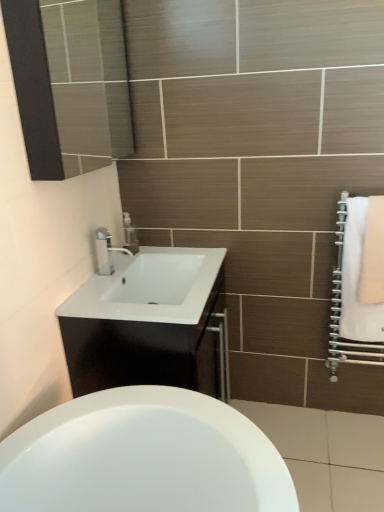
You are a GUI agent. You are given a task and a screenshot of the screen. Output one action in this format:
    pyautogui.click(x=<x>, y=<y>)
    Task: Click on the clear plastic soap dispenser at upper center
    
    Given the screenshot: What is the action you would take?
    pyautogui.click(x=130, y=234)

Image resolution: width=384 pixels, height=512 pixels. What do you see at coordinates (373, 255) in the screenshot?
I see `white soft towel at right, which appears as the 1th bath towel when viewed from the right` at bounding box center [373, 255].

Measure the distance between white glossy cabinet at center and camera.

The depth of white glossy cabinet at center is 4.24 feet.

How much space does white soft towel at right, arranged as the second bath towel when viewed from the right, occupy vertically?

white soft towel at right, arranged as the second bath towel when viewed from the right, is 58.49 centimeters in height.

Describe the element at coordinates (105, 251) in the screenshot. I see `satin nickel faucet at center` at that location.

Locate an element on the screen. This screenshot has width=384, height=512. clear plastic soap dispenser at upper center is located at coordinates (130, 234).

In the image, is clear plastic soap dispenser at upper center positioned in front of or behind black glass mirror at upper left?

clear plastic soap dispenser at upper center is behind black glass mirror at upper left.

Which is behind, point (124, 217) or point (76, 20)?

The point (124, 217) is farther from the camera.

From the image's perspective, relative to black glass mirror at upper left, is clear plastic soap dispenser at upper center above or below?

clear plastic soap dispenser at upper center is below black glass mirror at upper left.

Is clear plastic soap dispenser at upper center not near black glass mirror at upper left?

clear plastic soap dispenser at upper center is near black glass mirror at upper left, not far away.

Is white soft towel at right, which appears as the 1th bath towel when viewed from the right, facing towards white soft towel at right, arranged as the second bath towel when viewed from the right?

Yes, white soft towel at right, which appears as the 1th bath towel when viewed from the right, is oriented towards white soft towel at right, arranged as the second bath towel when viewed from the right.

Does white soft towel at right, which appears as the 1th bath towel when viewed from the right, have a greater height compared to white soft towel at right, arranged as the first bath towel when viewed from the left?

No, white soft towel at right, which appears as the 1th bath towel when viewed from the right, is not taller than white soft towel at right, arranged as the first bath towel when viewed from the left.

Between white soft towel at right, the second bath towel viewed from the left, and white soft towel at right, arranged as the first bath towel when viewed from the left, which one is positioned in front?

white soft towel at right, the second bath towel viewed from the left.

From the image's perspective, is white soft towel at right, the second bath towel viewed from the left, above or below white soft towel at right, arranged as the first bath towel when viewed from the left?

From the image's perspective, white soft towel at right, the second bath towel viewed from the left, appears above white soft towel at right, arranged as the first bath towel when viewed from the left.

Who is taller, black glass mirror at upper left or white soft towel at right, arranged as the second bath towel when viewed from the right?

white soft towel at right, arranged as the second bath towel when viewed from the right, is taller.

How different are the orientations of black glass mirror at upper left and white soft towel at right, arranged as the second bath towel when viewed from the right, in degrees?

They differ by 90 degrees in their facing directions.

This screenshot has width=384, height=512. I want to click on mirror located in front of the white soft towel at right, arranged as the first bath towel when viewed from the left, so click(x=70, y=83).

Between black glass mirror at upper left and white soft towel at right, arranged as the first bath towel when viewed from the left, which one has smaller width?

white soft towel at right, arranged as the first bath towel when viewed from the left.

Can you confirm if satin nickel faucet at center is positioned to the left of white soft towel at right, arranged as the second bath towel when viewed from the right?

Yes.

Is satin nickel faucet at center further to the viewer compared to white soft towel at right, arranged as the first bath towel when viewed from the left?

Yes.

Who is shorter, satin nickel faucet at center or white soft towel at right, arranged as the first bath towel when viewed from the left?

satin nickel faucet at center is shorter.

Are satin nickel faucet at center and white soft towel at right, arranged as the first bath towel when viewed from the left, making contact?

No, satin nickel faucet at center is not with white soft towel at right, arranged as the first bath towel when viewed from the left.

From the image's perspective, which object appears higher, clear plastic soap dispenser at upper center or white soft towel at right, the second bath towel viewed from the left?

clear plastic soap dispenser at upper center, from the image's perspective.

Is clear plastic soap dispenser at upper center wider or thinner than white soft towel at right, which appears as the 1th bath towel when viewed from the right?

clear plastic soap dispenser at upper center is thinner than white soft towel at right, which appears as the 1th bath towel when viewed from the right.

Looking at this image, is clear plastic soap dispenser at upper center looking in the opposite direction of white soft towel at right, the second bath towel viewed from the left?

No, clear plastic soap dispenser at upper center is not facing the opposite direction of white soft towel at right, the second bath towel viewed from the left.

Is clear plastic soap dispenser at upper center taller or shorter than white soft towel at right, which appears as the 1th bath towel when viewed from the right?

clear plastic soap dispenser at upper center is shorter than white soft towel at right, which appears as the 1th bath towel when viewed from the right.

From a real-world perspective, is satin nickel faucet at center physically located above or below clear plastic soap dispenser at upper center?

Clearly, from a real-world perspective, satin nickel faucet at center is above clear plastic soap dispenser at upper center.

Between point (113, 251) and point (129, 221), which one is positioned in front?

Positioned in front is point (113, 251).

Does satin nickel faucet at center appear on the right side of clear plastic soap dispenser at upper center?

In fact, satin nickel faucet at center is to the left of clear plastic soap dispenser at upper center.

From the picture: Is clear plastic soap dispenser at upper center a part of satin nickel faucet at center?

No, clear plastic soap dispenser at upper center is located outside of satin nickel faucet at center.

This screenshot has height=512, width=384. What are the coordinates of `bath towel that is the 2nd object directly below the satin nickel faucet at center (from a real-world perspective)` in the screenshot? It's located at (357, 280).

Would you consider white soft towel at right, arranged as the first bath towel when viewed from the left, to be distant from satin nickel faucet at center?

No, white soft towel at right, arranged as the first bath towel when viewed from the left, is not far from satin nickel faucet at center.

Which object is wider, white soft towel at right, arranged as the second bath towel when viewed from the right, or satin nickel faucet at center?

satin nickel faucet at center is wider.

Identify the location of mirror on the left of clear plastic soap dispenser at upper center. The height and width of the screenshot is (512, 384). (70, 83).

Where is `bath towel on the right of white soft towel at right, arranged as the second bath towel when viewed from the right`? bath towel on the right of white soft towel at right, arranged as the second bath towel when viewed from the right is located at coordinates (373, 255).

From the image, which object appears to be nearer to clear plastic soap dispenser at upper center, white glossy cabinet at center or satin nickel faucet at center?

satin nickel faucet at center.

Looking at the image, which one is located closer to satin nickel faucet at center, white soft towel at right, the second bath towel viewed from the left, or white soft towel at right, arranged as the second bath towel when viewed from the right?

Based on the image, white soft towel at right, arranged as the second bath towel when viewed from the right, appears to be nearer to satin nickel faucet at center.

Estimate the real-world distances between objects in this image. Which object is closer to white glossy cabinet at center, white soft towel at right, the second bath towel viewed from the left, or black glass mirror at upper left?

white soft towel at right, the second bath towel viewed from the left.

From the image, which object appears to be farther from white soft towel at right, arranged as the second bath towel when viewed from the right, clear plastic soap dispenser at upper center or satin nickel faucet at center?

satin nickel faucet at center is further to white soft towel at right, arranged as the second bath towel when viewed from the right.

Estimate the real-world distances between objects in this image. Which object is closer to clear plastic soap dispenser at upper center, white soft towel at right, arranged as the first bath towel when viewed from the left, or white glossy cabinet at center?

Among the two, white glossy cabinet at center is located nearer to clear plastic soap dispenser at upper center.

When comparing their distances from white soft towel at right, arranged as the second bath towel when viewed from the right, does satin nickel faucet at center or white soft towel at right, which appears as the 1th bath towel when viewed from the right, seem further?

Based on the image, satin nickel faucet at center appears to be further to white soft towel at right, arranged as the second bath towel when viewed from the right.

In the scene shown: From the image, which object appears to be farther from white soft towel at right, which appears as the 1th bath towel when viewed from the right, white soft towel at right, arranged as the first bath towel when viewed from the left, or black glass mirror at upper left?

black glass mirror at upper left lies further to white soft towel at right, which appears as the 1th bath towel when viewed from the right, than the other object.

Which object lies further to the anchor point black glass mirror at upper left, white soft towel at right, arranged as the first bath towel when viewed from the left, or white glossy cabinet at center?

The object further to black glass mirror at upper left is white soft towel at right, arranged as the first bath towel when viewed from the left.

You are a GUI agent. You are given a task and a screenshot of the screen. Output one action in this format:
    pyautogui.click(x=<x>, y=<y>)
    Task: Click on the bathroom cabinet between satin nickel faucet at center and white soft towel at right, which appears as the 1th bath towel when viewed from the right, in the horizontal direction
    This screenshot has width=384, height=512.
    Given the screenshot: What is the action you would take?
    pyautogui.click(x=150, y=350)

Identify the location of tap between clear plastic soap dispenser at upper center and white glossy cabinet at center from top to bottom. The height and width of the screenshot is (512, 384). (105, 251).

This screenshot has height=512, width=384. I want to click on bath towel between white glossy cabinet at center and white soft towel at right, which appears as the 1th bath towel when viewed from the right, so click(x=357, y=280).

You are a GUI agent. You are given a task and a screenshot of the screen. Output one action in this format:
    pyautogui.click(x=<x>, y=<y>)
    Task: Click on the tap that lies between black glass mirror at upper left and white glossy cabinet at center from top to bottom
    The image size is (384, 512).
    Given the screenshot: What is the action you would take?
    pyautogui.click(x=105, y=251)